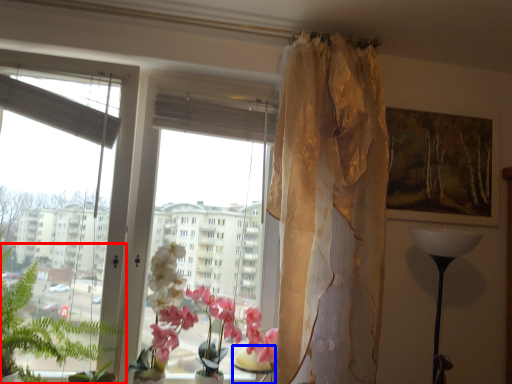
Question: Which object appears farthest to the camera in this image, vegetation (highlighted by a red box) or table (highlighted by a blue box)?

Choices:
 (A) vegetation
 (B) table

Answer: (B)